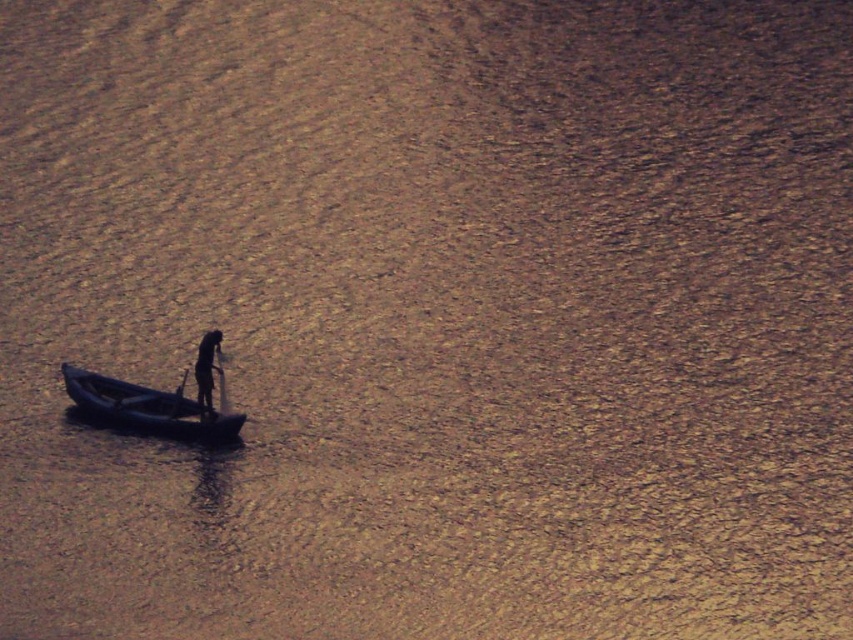
Question: Which point is closer to the camera?

Choices:
 (A) black plastic paddle at center
 (B) blue rubber canoe at center
 (C) black matte person at center

Answer: (B)

Question: Does black matte person at center have a larger size compared to black plastic paddle at center?

Choices:
 (A) no
 (B) yes

Answer: (B)

Question: Which point is closer to the camera?

Choices:
 (A) black matte person at center
 (B) black plastic paddle at center
 (C) blue rubber canoe at center

Answer: (C)

Question: Can you confirm if blue rubber canoe at center is wider than black plastic paddle at center?

Choices:
 (A) no
 (B) yes

Answer: (B)

Question: Which of the following is the closest to the observer?

Choices:
 (A) (194, 378)
 (B) (213, 413)
 (C) (186, 378)

Answer: (B)

Question: Can you confirm if blue rubber canoe at center is smaller than black matte person at center?

Choices:
 (A) no
 (B) yes

Answer: (A)